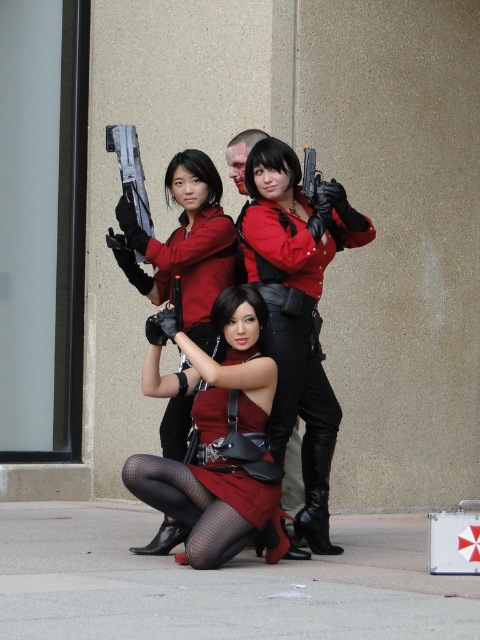
Can you confirm if matte black gun at center is shorter than matte red dress at center?

No.

The image size is (480, 640). What are the coordinates of `matte black gun at center` in the screenshot? It's located at (297, 308).

Image resolution: width=480 pixels, height=640 pixels. Find the location of `matte black gun at center`. matte black gun at center is located at coordinates (297, 308).